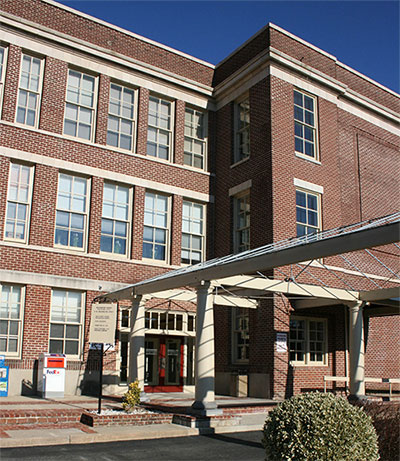
This screenshot has width=400, height=461. Identify the location of doors. (157, 376).